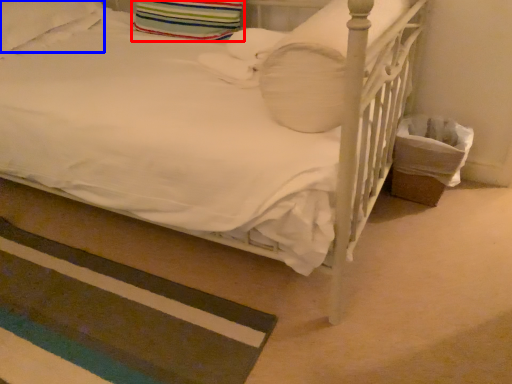
Question: Which object is closer to the camera taking this photo, pillow (highlighted by a red box) or pillow (highlighted by a blue box)?

Choices:
 (A) pillow
 (B) pillow

Answer: (B)